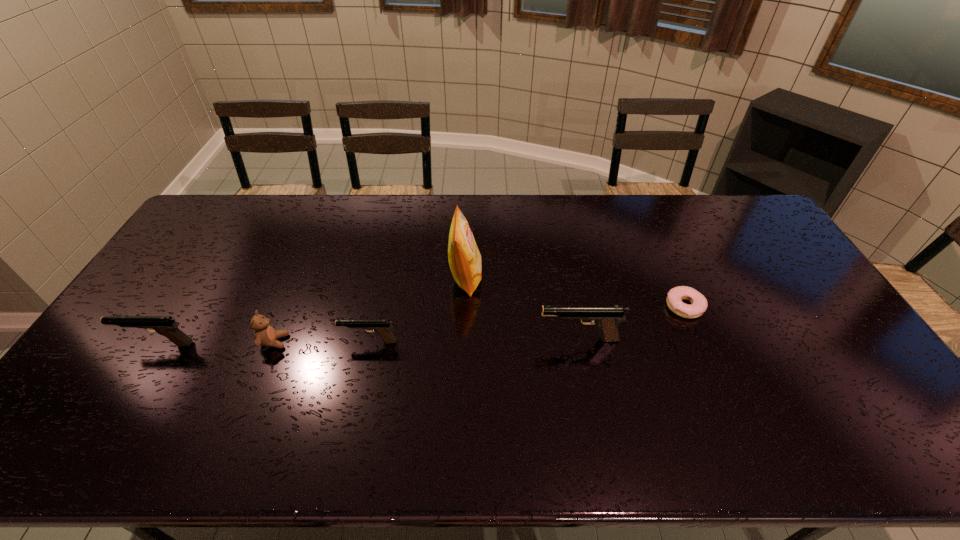
Locate an element on the screen. free space between the tallest object and the leftmost object is located at coordinates tap(312, 311).

The height and width of the screenshot is (540, 960). Identify the location of unoccupied area between the teddy bear and the rightmost pistol. click(426, 340).

The image size is (960, 540). Find the location of `vacant area between the second object from right to left and the doughnut`. vacant area between the second object from right to left and the doughnut is located at coordinates (632, 323).

Where is `free spot between the doughnut and the teddy bear`? free spot between the doughnut and the teddy bear is located at coordinates (479, 324).

You are a GUI agent. You are given a task and a screenshot of the screen. Output one action in this format:
    pyautogui.click(x=<x>, y=<y>)
    Task: Click on the free space between the fifth object from right to left and the crisp (potato chip)
    
    Given the screenshot: What is the action you would take?
    pyautogui.click(x=370, y=310)

Locate an element on the screen. unoccupied area between the teddy bear and the second shortest pistol is located at coordinates (216, 343).

At what (x,y) coordinates should I click in order to perform the action: click on free space between the leftmost pistol and the teddy bear. Please return your answer as a coordinate pair (x, y). The height and width of the screenshot is (540, 960). Looking at the image, I should click on (216, 343).

Choose which object is the fifth nearest neighbor to the shortest pistol. Please provide its 2D coordinates. Your answer should be formatted as a tuple, i.e. [(x, y)], where the tuple contains the x and y coordinates of a point satisfying the conditions above.

[(698, 306)]

Identify which object is the fifth closest to the leftmost object. Please provide its 2D coordinates. Your answer should be formatted as a tuple, i.e. [(x, y)], where the tuple contains the x and y coordinates of a point satisfying the conditions above.

[(698, 306)]

Where is `pistol that stands as the second closest to the third object from left to right`? This screenshot has width=960, height=540. pistol that stands as the second closest to the third object from left to right is located at coordinates (164, 325).